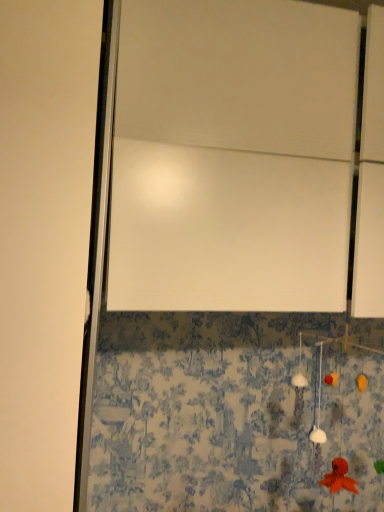
The image size is (384, 512). What do you see at coordinates (237, 412) in the screenshot?
I see `blue floral fabric at lower center` at bounding box center [237, 412].

Where is `blue floral fabric at lower center`? The width and height of the screenshot is (384, 512). blue floral fabric at lower center is located at coordinates (237, 412).

The height and width of the screenshot is (512, 384). What are the coordinates of `blue floral fabric at lower center` in the screenshot? It's located at click(x=237, y=412).